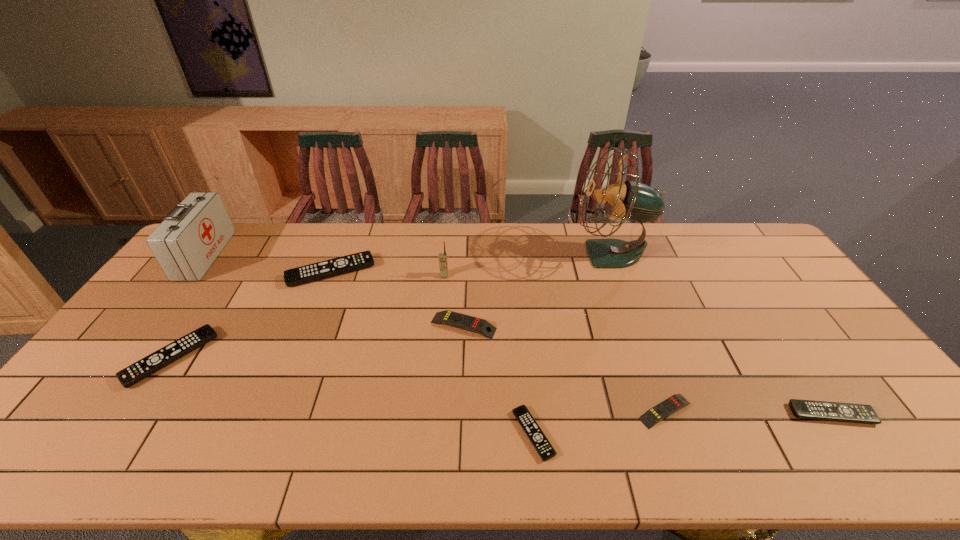
At what (x,y) coordinates should I click in order to perform the action: click on vacant point located 0.120m on the front-facing side of the first-aid kit. Please return your answer as a coordinate pair (x, y). The image size is (960, 540). Looking at the image, I should click on (252, 255).

You are a GUI agent. You are given a task and a screenshot of the screen. Output one action in this format:
    pyautogui.click(x=<x>, y=<y>)
    Task: Click on the free space located on the front of the third tallest object, where the keypad is located
    The image size is (960, 540).
    Given the screenshot: What is the action you would take?
    pyautogui.click(x=439, y=336)

Where is `vacant region located 0.380m on the left of the fifth remote control from right to left`? The width and height of the screenshot is (960, 540). vacant region located 0.380m on the left of the fifth remote control from right to left is located at coordinates (175, 272).

This screenshot has width=960, height=540. In order to click on vacant space situated on the back of the bigger yellow remote control in this screenshot , I will do `click(465, 286)`.

Find the location of a particular element. This screenshot has width=960, height=540. blank area located on the right of the leftmost remote control is located at coordinates (350, 357).

Identify the location of free spot located on the left of the right yellow remote control. (514, 411).

At what (x,y) coordinates should I click in order to perform the action: click on free space located on the left of the second smallest black remote control. Please return your answer as a coordinate pair (x, y). The width and height of the screenshot is (960, 540). Looking at the image, I should click on (677, 414).

The image size is (960, 540). I want to click on free space located on the right of the shortest remote control, so click(630, 434).

Where is `fan positioned at the far edge`? fan positioned at the far edge is located at coordinates (632, 200).

This screenshot has height=540, width=960. Identify the location of the first-aid kit that is at the far edge. (190, 238).